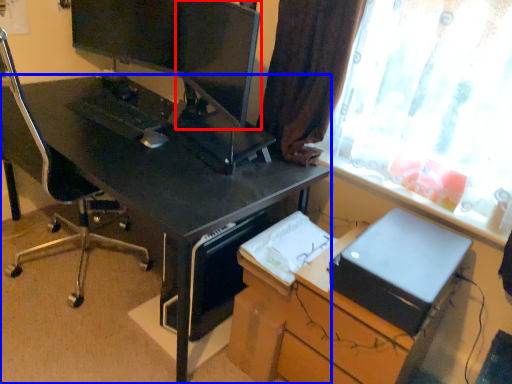
Question: Which of the following is the closest to the observer, computer monitor (highlighted by a red box) or desk (highlighted by a blue box)?

Choices:
 (A) computer monitor
 (B) desk

Answer: (B)